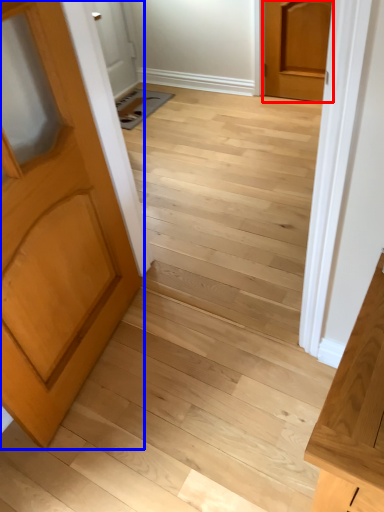
Question: Which of the following is the closest to the observer, door (highlighted by a red box) or door (highlighted by a blue box)?

Choices:
 (A) door
 (B) door

Answer: (B)